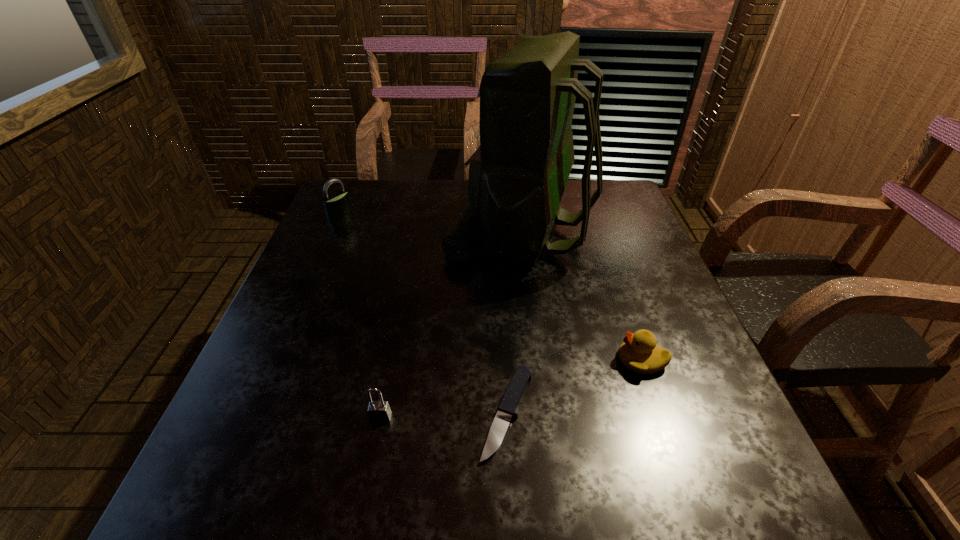
Locate an element on the screen. free location located 0.130m on the front of the taller padlock is located at coordinates (324, 250).

Locate an element on the screen. The image size is (960, 540). free point located on the shackle of the nearer padlock is located at coordinates (374, 450).

You are a GUI agent. You are given a task and a screenshot of the screen. Output one action in this format:
    pyautogui.click(x=<x>, y=<y>)
    Task: Click on the free space located on the front-facing side of the duckling
    Image resolution: width=960 pixels, height=540 pixels.
    Given the screenshot: What is the action you would take?
    pyautogui.click(x=422, y=360)

You are a GUI agent. You are given a task and a screenshot of the screen. Output one action in this format:
    pyautogui.click(x=<x>, y=<y>)
    Task: Click on the vacant position located on the front-facing side of the duckling
    
    Given the screenshot: What is the action you would take?
    pyautogui.click(x=503, y=360)

You are a GUI agent. You are given a task and a screenshot of the screen. Output one action in this format:
    pyautogui.click(x=<x>, y=<y>)
    Task: Click on the blank space located 0.220m on the front-facing side of the duckling
    The image size is (960, 540).
    Given the screenshot: What is the action you would take?
    pyautogui.click(x=508, y=360)

The width and height of the screenshot is (960, 540). I want to click on free region located 0.060m on the right of the shortest object, so click(x=568, y=413).

Locate an element on the screen. Image resolution: width=960 pixels, height=540 pixels. backpack that is at the far edge is located at coordinates (517, 176).

Image resolution: width=960 pixels, height=540 pixels. In order to click on padlock located in the far edge section of the desktop in this screenshot , I will do `click(336, 206)`.

Where is `object located at the near edge`? This screenshot has width=960, height=540. object located at the near edge is located at coordinates (506, 411).

What are the coordinates of `object located in the left edge section of the desktop` in the screenshot? It's located at (336, 206).